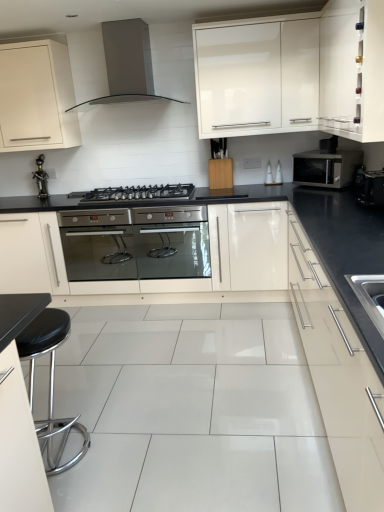
Question: Is white glossy cabinet at upper right, which is counted as the 4th cabinetry, starting from the left, positioned with its back to satin silver microwave at right?

Choices:
 (A) no
 (B) yes

Answer: (A)

Question: Is white glossy cabinet at upper right, which is counted as the 4th cabinetry, starting from the left, to the right of satin silver microwave at right from the viewer's perspective?

Choices:
 (A) yes
 (B) no

Answer: (A)

Question: Is satin silver microwave at right surrounded by white glossy cabinet at upper right, placed as the first cabinetry when sorted from right to left?

Choices:
 (A) yes
 (B) no

Answer: (B)

Question: Does white glossy cabinet at upper right, which is counted as the 4th cabinetry, starting from the left, have a greater height compared to satin silver microwave at right?

Choices:
 (A) yes
 (B) no

Answer: (A)

Question: From a real-world perspective, is white glossy cabinet at upper right, which is counted as the 4th cabinetry, starting from the left, below satin silver microwave at right?

Choices:
 (A) yes
 (B) no

Answer: (B)

Question: In terms of width, does satin silver drawer at right, the third cabinetry positioned from the left, look wider or thinner when compared to glossy white cabinet at upper center?

Choices:
 (A) wide
 (B) thin

Answer: (A)

Question: Is satin silver drawer at right, the third cabinetry positioned from the left, bigger or smaller than glossy white cabinet at upper center?

Choices:
 (A) big
 (B) small

Answer: (A)

Question: From the image's perspective, is satin silver drawer at right, the second cabinetry viewed from the right, located above or below glossy white cabinet at upper center?

Choices:
 (A) below
 (B) above

Answer: (A)

Question: Is satin silver drawer at right, the third cabinetry positioned from the left, situated inside glossy white cabinet at upper center or outside?

Choices:
 (A) inside
 (B) outside

Answer: (B)

Question: Is black matte gas stove at center in front of or behind glossy white cabinet at upper center in the image?

Choices:
 (A) front
 (B) behind

Answer: (B)

Question: From their relative heights in the image, would you say black matte gas stove at center is taller or shorter than glossy white cabinet at upper center?

Choices:
 (A) short
 (B) tall

Answer: (A)

Question: Looking at their shapes, would you say black matte gas stove at center is wider or thinner than glossy white cabinet at upper center?

Choices:
 (A) thin
 (B) wide

Answer: (B)

Question: Based on their sizes in the image, would you say black matte gas stove at center is bigger or smaller than glossy white cabinet at upper center?

Choices:
 (A) big
 (B) small

Answer: (B)

Question: Looking at their shapes, would you say stainless steel oven at center is wider or thinner than metallic figurine at left?

Choices:
 (A) thin
 (B) wide

Answer: (B)

Question: Is point (104, 238) positioned closer to the camera than point (39, 175)?

Choices:
 (A) farther
 (B) closer

Answer: (B)